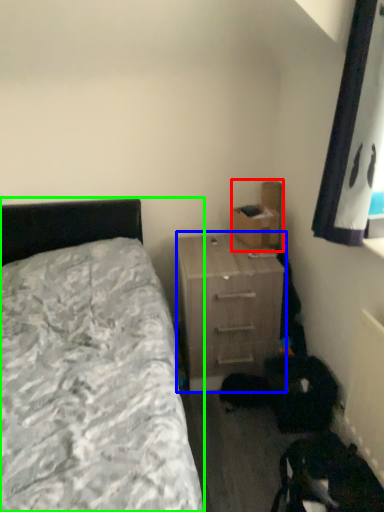
Question: Which object is the closest to the cardboard box (highlighted by a red box)? Choose among these: nightstand (highlighted by a blue box) or bed (highlighted by a green box).

Choices:
 (A) nightstand
 (B) bed

Answer: (A)